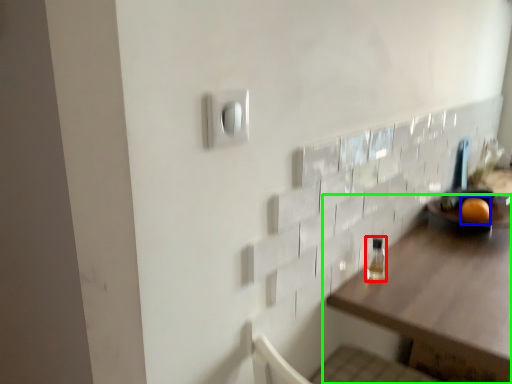
Question: Which is farther away from bottle (highlighted by a red box)? orange (highlighted by a blue box) or table (highlighted by a green box)?

Choices:
 (A) orange
 (B) table

Answer: (A)